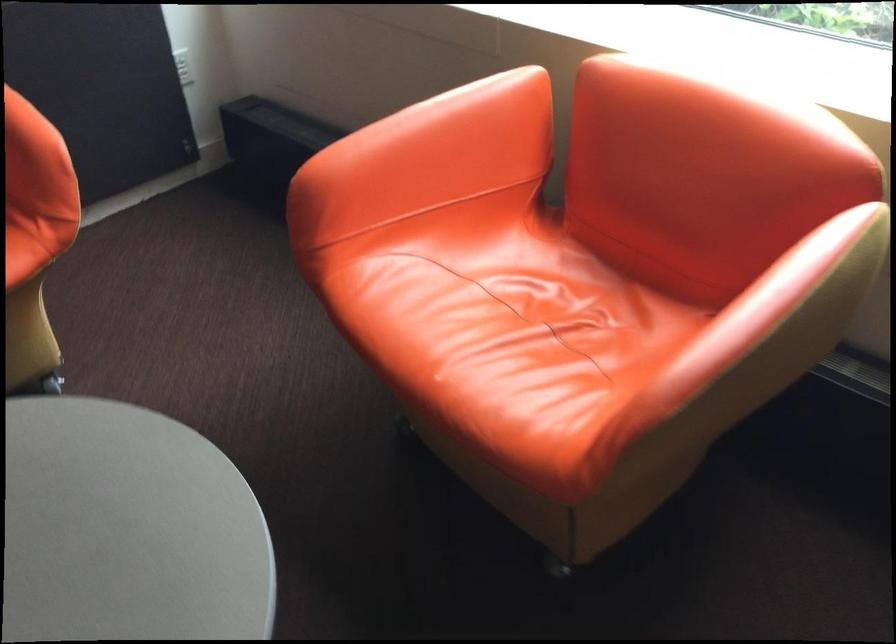
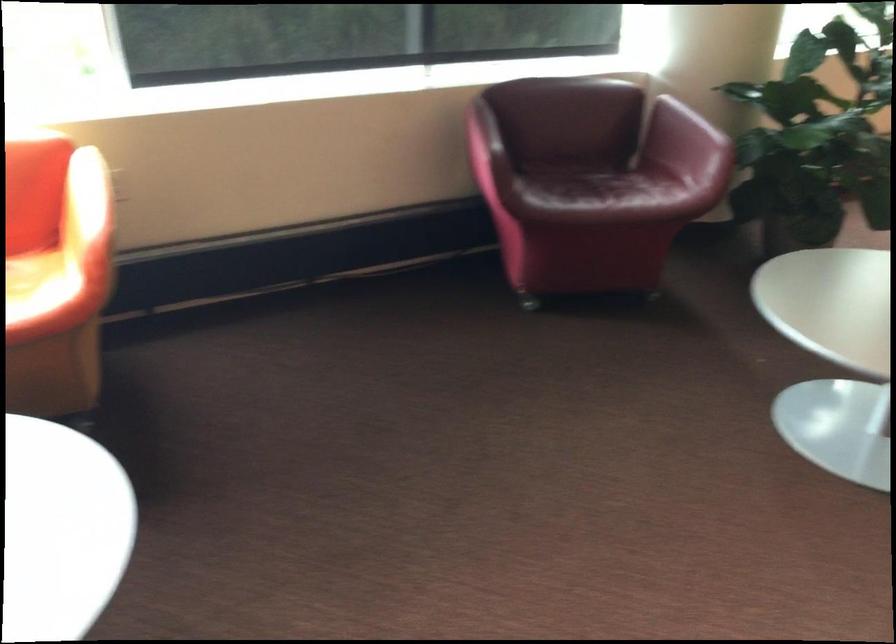
In the second image, find the point that corresponds to point (591, 377) in the first image.

(35, 285)